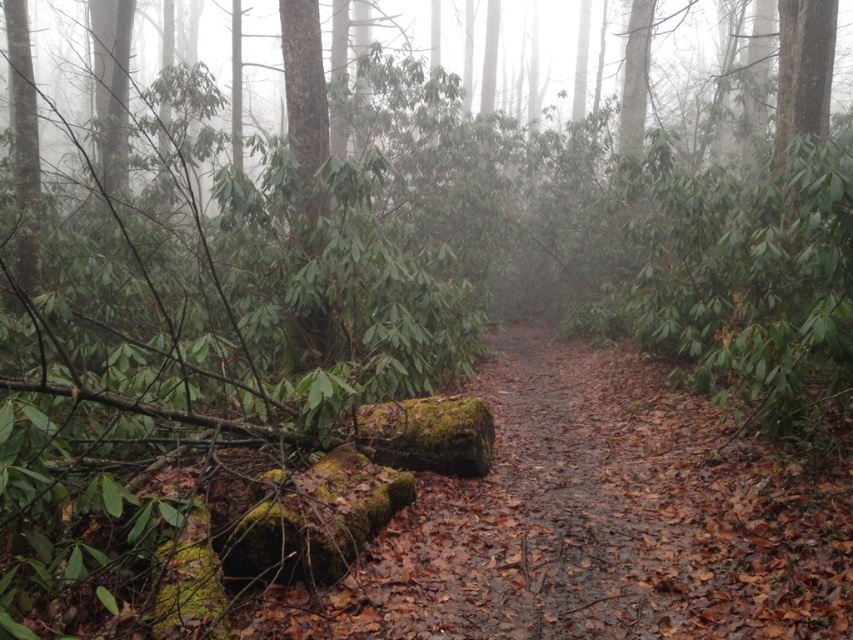
Can you confirm if green mossy tree trunk at center is thinner than green mossy log at left?

Correct, green mossy tree trunk at center's width is less than green mossy log at left's.

Between green mossy tree trunk at center and green mossy log at left, which one has more height?

With more height is green mossy log at left.

I want to click on green mossy tree trunk at center, so click(305, 99).